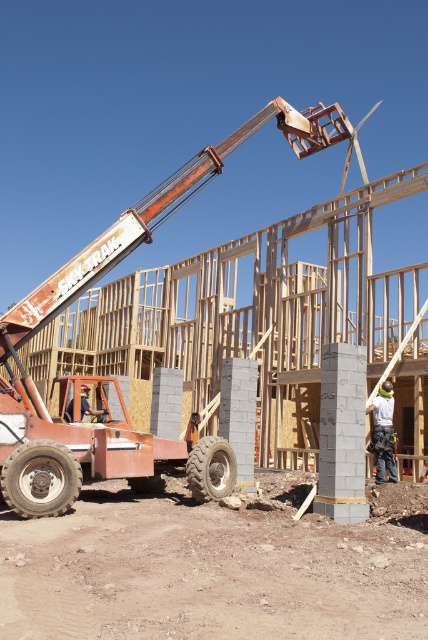
Question: Which object appears farthest from the camera in this image?

Choices:
 (A) white hard hat at center
 (B) orange metallic crane at center

Answer: (A)

Question: Which point is closer to the camera?

Choices:
 (A) (385, 417)
 (B) (77, 404)

Answer: (B)

Question: Can you confirm if orange metallic crane at center is positioned to the right of white hard hat at center?

Choices:
 (A) yes
 (B) no

Answer: (B)

Question: Is orange metallic crane at center below white hard hat at center?

Choices:
 (A) no
 (B) yes

Answer: (A)

Question: Is orange metallic crane at center thinner than white hard hat at center?

Choices:
 (A) yes
 (B) no

Answer: (B)

Question: Which point is farther to the camera?

Choices:
 (A) orange metallic crane at center
 (B) white hard hat at center

Answer: (B)